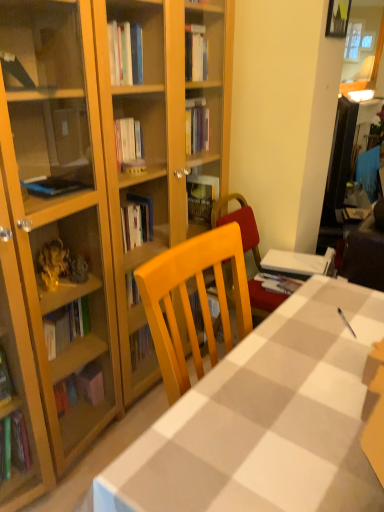
The image size is (384, 512). Identify the location of white checkered tablecloth at center. coord(266,420).

What do you see at coordinates (266, 420) in the screenshot?
I see `white checkered tablecloth at center` at bounding box center [266, 420].

Describe the element at coordinates (338, 18) in the screenshot. I see `wooden picture frame at upper right` at that location.

Locate an element on the screen. wooden picture frame at upper right is located at coordinates (338, 18).

Image resolution: width=384 pixels, height=512 pixels. I want to click on white checkered tablecloth at center, so click(x=266, y=420).

Which object is positioned more to the left, white checkered tablecloth at center or wooden picture frame at upper right?

From the viewer's perspective, white checkered tablecloth at center appears more on the left side.

Does white checkered tablecloth at center come in front of wooden picture frame at upper right?

Yes, white checkered tablecloth at center is closer to the viewer.

Is point (287, 318) positioned in front of point (344, 20)?

Yes, point (287, 318) is closer to viewer.

In the scene shown: From the image's perspective, would you say white checkered tablecloth at center is positioned over wooden picture frame at upper right?

No, from the image's perspective, white checkered tablecloth at center is not over wooden picture frame at upper right.

From a real-world perspective, is white checkered tablecloth at center on top of wooden picture frame at upper right?

Incorrect, from a real-world perspective, white checkered tablecloth at center is lower than wooden picture frame at upper right.

From the picture: Looking at their sizes, would you say white checkered tablecloth at center is wider or thinner than wooden picture frame at upper right?

In the image, white checkered tablecloth at center appears to be wider than wooden picture frame at upper right.

Is white checkered tablecloth at center shorter than wooden picture frame at upper right?

No, white checkered tablecloth at center is not shorter than wooden picture frame at upper right.

Between white checkered tablecloth at center and wooden picture frame at upper right, which one has larger size?

Bigger between the two is white checkered tablecloth at center.

Is white checkered tablecloth at center not inside wooden picture frame at upper right?

Yes, white checkered tablecloth at center is located beyond the bounds of wooden picture frame at upper right.

Is white checkered tablecloth at center placed right next to wooden picture frame at upper right?

No, white checkered tablecloth at center is not making contact with wooden picture frame at upper right.

Is white checkered tablecloth at center oriented towards wooden picture frame at upper right?

No, white checkered tablecloth at center does not turn towards wooden picture frame at upper right.

What's the angular difference between white checkered tablecloth at center and wooden picture frame at upper right's facing directions?

The facing directions of white checkered tablecloth at center and wooden picture frame at upper right are 0.243 degrees apart.

In the image, there is a white checkered tablecloth at center. Identify the location of picture frame above it (from the image's perspective). (338, 18).

Does wooden picture frame at upper right appear on the left side of white checkered tablecloth at center?

No, wooden picture frame at upper right is not to the left of white checkered tablecloth at center.

Which is in front, wooden picture frame at upper right or white checkered tablecloth at center?

white checkered tablecloth at center is more forward.

Is point (337, 19) in front of point (332, 505)?

No, it is behind (332, 505).

From the image's perspective, between wooden picture frame at upper right and white checkered tablecloth at center, who is located below?

From the image's view, white checkered tablecloth at center is below.

From a real-world perspective, which object stands above the other?

In real-world perspective, wooden picture frame at upper right is above.

Looking at their sizes, would you say wooden picture frame at upper right is wider or thinner than white checkered tablecloth at center?

Clearly, wooden picture frame at upper right has less width compared to white checkered tablecloth at center.

Can you confirm if wooden picture frame at upper right is shorter than white checkered tablecloth at center?

Correct, wooden picture frame at upper right is not as tall as white checkered tablecloth at center.

Can you confirm if wooden picture frame at upper right is smaller than white checkered tablecloth at center?

Correct, wooden picture frame at upper right occupies less space than white checkered tablecloth at center.

Does wooden picture frame at upper right contain white checkered tablecloth at center?

No, white checkered tablecloth at center is located outside of wooden picture frame at upper right.

Is wooden picture frame at upper right directly adjacent to white checkered tablecloth at center?

They are not placed beside each other.

In the scene shown: Is wooden picture frame at upper right aimed at white checkered tablecloth at center?

No, wooden picture frame at upper right is not turned towards white checkered tablecloth at center.

Locate an element on the screen. picture frame above the white checkered tablecloth at center (from a real-world perspective) is located at coordinates (338, 18).

Where is `picture frame behind the white checkered tablecloth at center`? The width and height of the screenshot is (384, 512). picture frame behind the white checkered tablecloth at center is located at coordinates (338, 18).

This screenshot has height=512, width=384. What are the coordinates of `desk below the wooden picture frame at upper right (from the image's perspective)` in the screenshot? It's located at (266, 420).